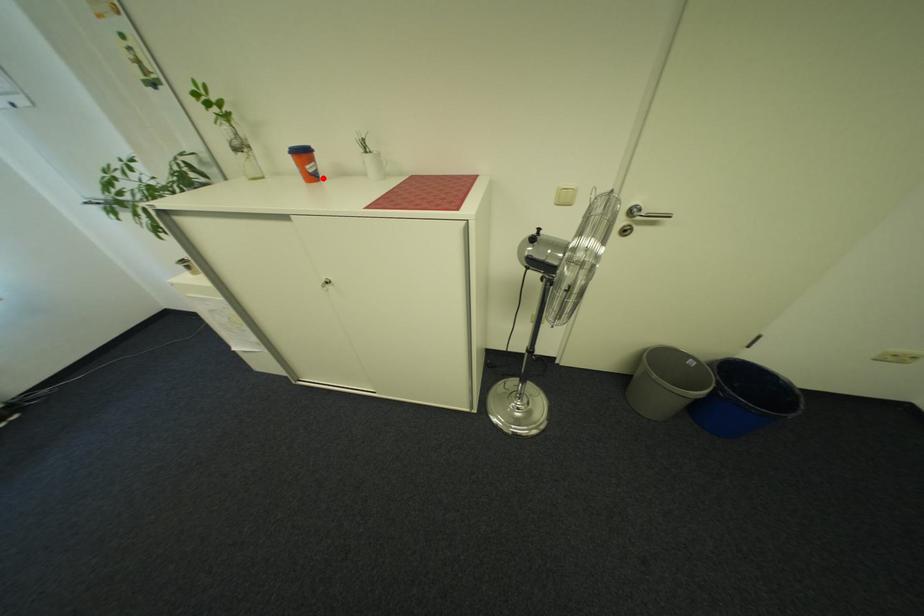
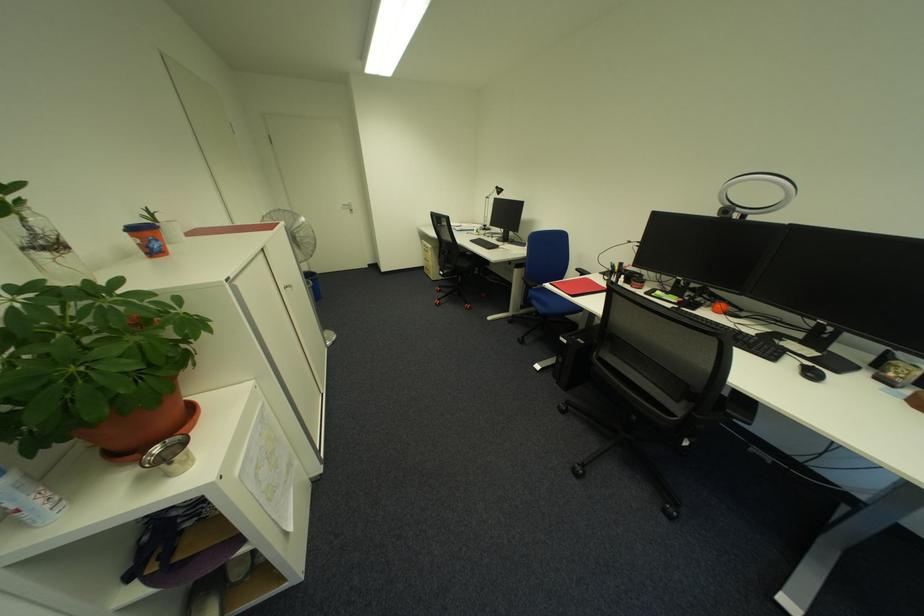
The point at the highlighted location is marked in the first image. Where is the corresponding point in the second image?

(164, 254)